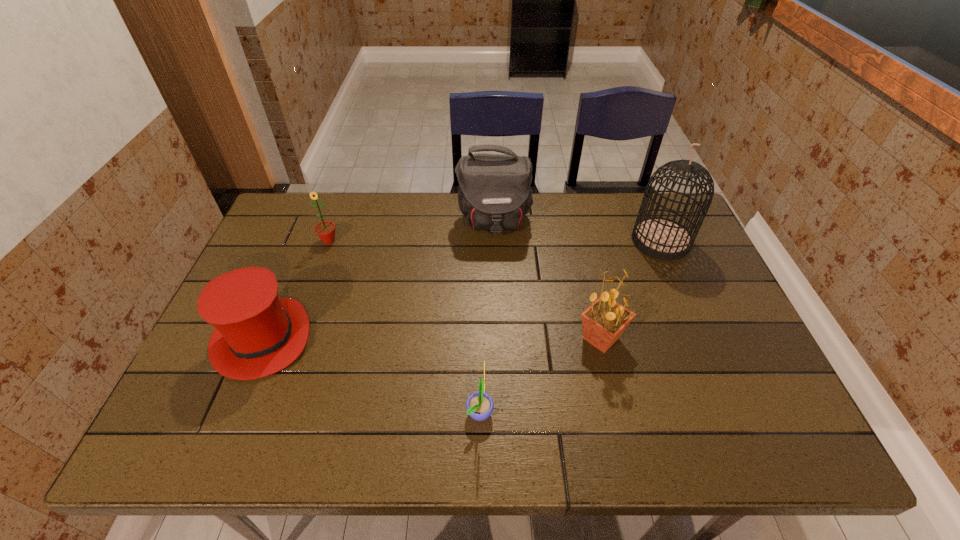
Where is `vacant space at the near right corner of the desktop`? This screenshot has height=540, width=960. vacant space at the near right corner of the desktop is located at coordinates (759, 443).

Locate an element on the screen. The height and width of the screenshot is (540, 960). free area in between the leftmost sunflower and the hat is located at coordinates (296, 289).

Locate an element on the screen. This screenshot has height=540, width=960. vacant region between the rightmost sunflower and the hat is located at coordinates (432, 338).

Where is `free space between the fourth shortest object and the rightmost object`? The width and height of the screenshot is (960, 540). free space between the fourth shortest object and the rightmost object is located at coordinates (631, 290).

In order to click on free point between the leftmost sunflower and the nearest sunflower in this screenshot , I will do `click(404, 326)`.

The image size is (960, 540). Identify the location of free spot between the shoulder bag and the leftmost sunflower. (411, 231).

Locate an element on the screen. The height and width of the screenshot is (540, 960). vacant area that lies between the rightmost object and the nearest sunflower is located at coordinates point(570,326).

Identify the location of free space between the hat and the shoulder bag. (378, 280).

You are a GUI agent. You are given a task and a screenshot of the screen. Output one action in this format:
    pyautogui.click(x=<x>, y=<y>)
    Task: Click on the unoccupied position between the hat and the rightmost object
    
    Given the screenshot: What is the action you would take?
    pyautogui.click(x=462, y=289)

Where is `empty space between the hat and the birdcage`? empty space between the hat and the birdcage is located at coordinates (462, 289).